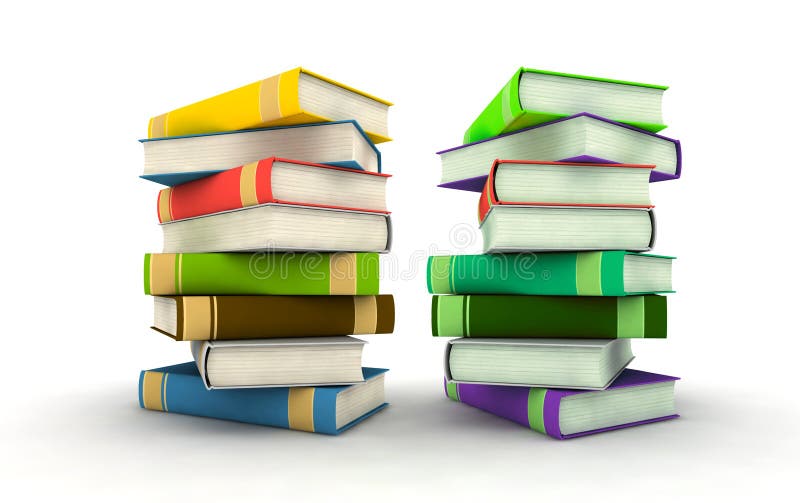
I want to click on books with green on it, so click(x=260, y=278), click(x=546, y=94), click(x=556, y=281), click(x=564, y=317), click(x=534, y=414).